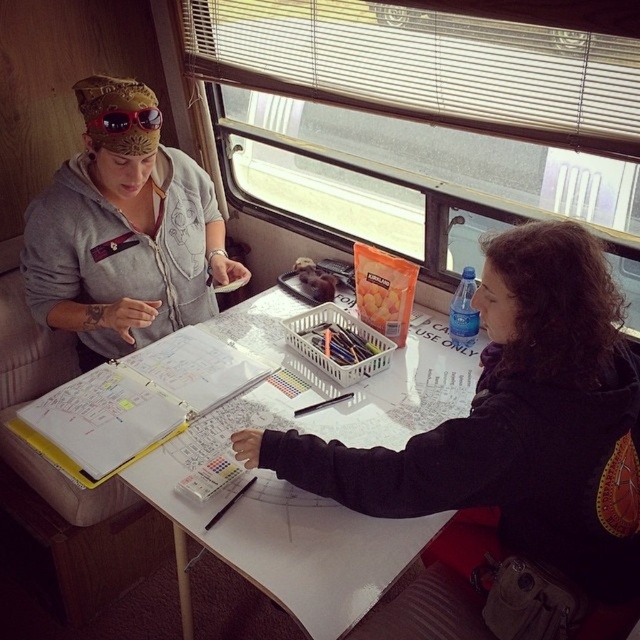
You are a photographer standing in front of the matte gray hoodie at upper left. You want to take a closeup shot of it without moving the camera. Is the hoodie within your camera lens range if the minimum focusing distance is 1.5 meters?

The matte gray hoodie at upper left is 1.45 meters away from the camera, which is within the minimum focusing distance of 1.5 meters. Therefore, the photographer can take a closeup shot of the matte gray hoodie at upper left without moving the camera.